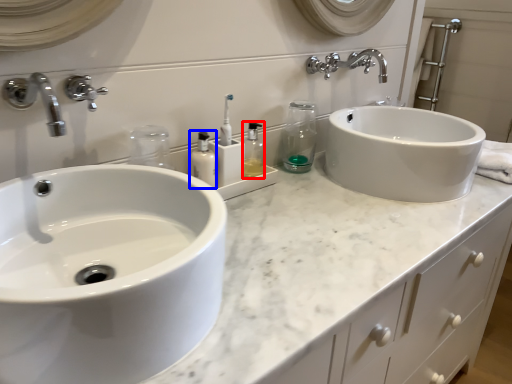
Question: Among these objects, which one is farthest to the camera, toiletry (highlighted by a red box) or mouthwash (highlighted by a blue box)?

Choices:
 (A) toiletry
 (B) mouthwash

Answer: (A)